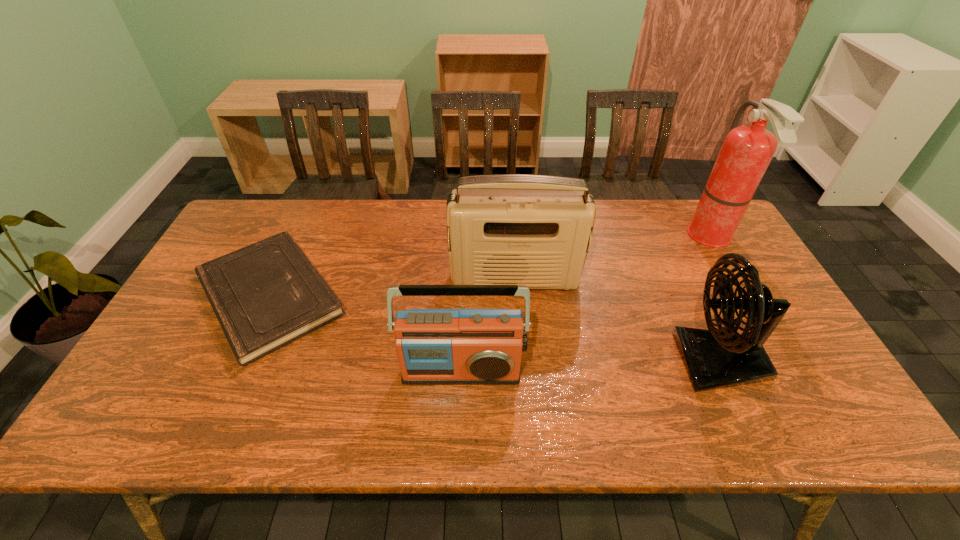
I want to click on fire extinguisher, so click(747, 150).

The height and width of the screenshot is (540, 960). In order to click on the farther radio receiver in this screenshot , I will do `click(515, 229)`.

In order to click on fan in this screenshot , I will do `click(715, 358)`.

Find the location of a particular element. This screenshot has height=540, width=960. the fourth tallest object is located at coordinates (434, 346).

Find the location of `the shorter radio receiver`. the shorter radio receiver is located at coordinates (434, 346).

Where is `the leftmost object`? The width and height of the screenshot is (960, 540). the leftmost object is located at coordinates (266, 295).

This screenshot has height=540, width=960. I want to click on paperback book, so click(x=266, y=295).

Identify the location of blank space located with the handle and hose on the fire extinguisher. This screenshot has width=960, height=540. (659, 238).

Locate an element on the screen. The width and height of the screenshot is (960, 540). vacant space located 0.160m with the handle and hose on the fire extinguisher is located at coordinates (640, 238).

Locate an element on the screen. vacant space located 0.170m with the handle and hose on the fire extinguisher is located at coordinates (637, 238).